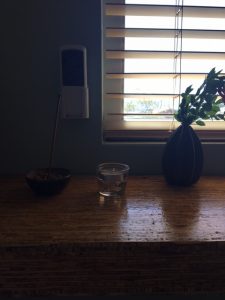
Where is `black section of white wall device`? The image size is (225, 300). black section of white wall device is located at coordinates (71, 67).